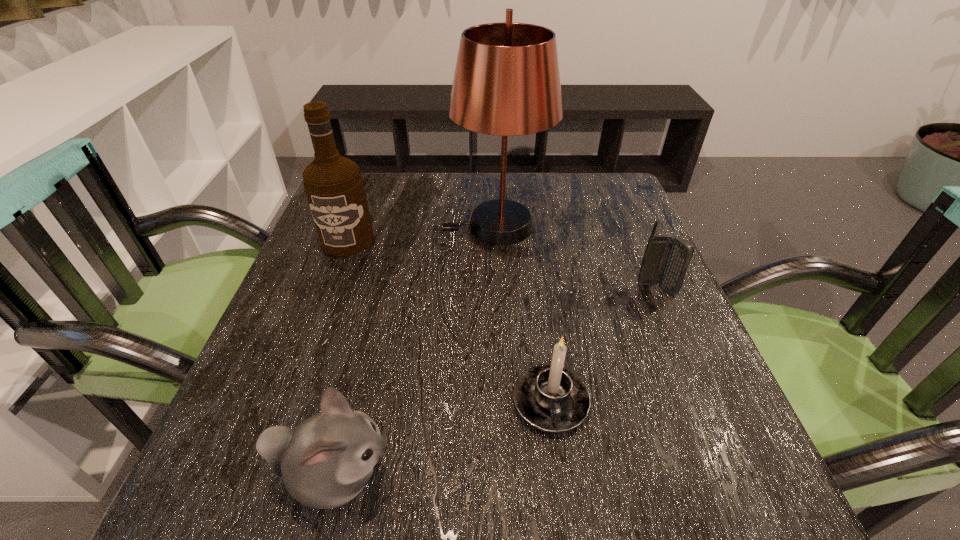
Identify the location of the tallest object. Image resolution: width=960 pixels, height=540 pixels. (507, 82).

You are a GUI agent. You are given a task and a screenshot of the screen. Output one action in this format:
    pyautogui.click(x=<x>, y=<y>)
    Task: Click on the second tallest object
    Image resolution: width=960 pixels, height=540 pixels.
    Given the screenshot: What is the action you would take?
    pyautogui.click(x=334, y=186)

The height and width of the screenshot is (540, 960). Identify the location of candle holder. (553, 399).

This screenshot has width=960, height=540. What are the coordinates of `the third nearest object` in the screenshot? It's located at (666, 260).

You are a GUI agent. You are given a task and a screenshot of the screen. Output one action in this format:
    pyautogui.click(x=<x>, y=<y>)
    Task: Click on the rightmost object
    Image resolution: width=960 pixels, height=540 pixels.
    Given the screenshot: What is the action you would take?
    pyautogui.click(x=666, y=260)

In order to click on hamster in this screenshot , I will do `click(325, 462)`.

This screenshot has width=960, height=540. I want to click on free location located on the front-facing side of the tallest object, so click(x=334, y=226).

At what (x,y) coordinates should I click in order to perform the action: click on free space located 0.080m on the front-facing side of the tallest object. Please return your answer as a coordinate pair (x, y). Looking at the image, I should click on (409, 226).

The width and height of the screenshot is (960, 540). Identify the location of free space located 0.260m on the front-facing side of the tallest object. (334, 226).

The width and height of the screenshot is (960, 540). Find the location of `free space located on the label of the alcohol`. free space located on the label of the alcohol is located at coordinates (311, 341).